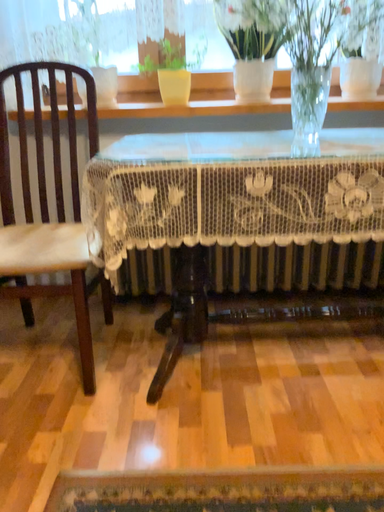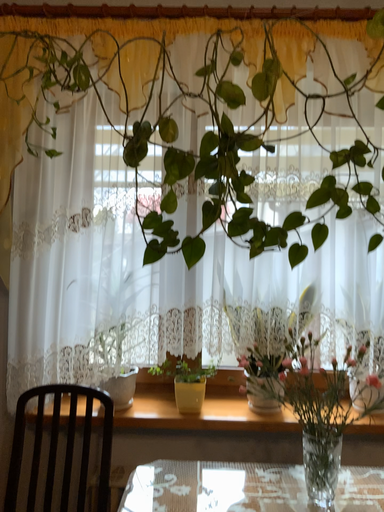
Question: How did the camera likely rotate when shooting the video?

Choices:
 (A) rotated downward
 (B) rotated upward

Answer: (B)